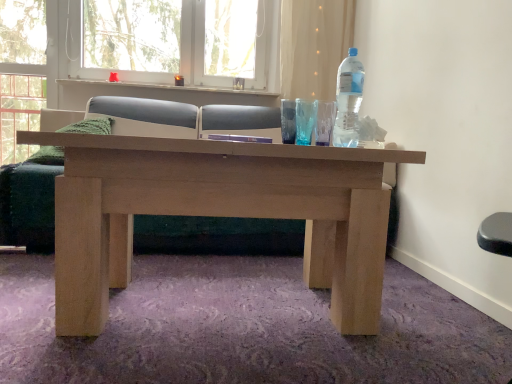
Measure the distance between transparent plastic bottle at upper right and camera.

The depth of transparent plastic bottle at upper right is 2.71 meters.

Find the location of a particular element. This screenshot has height=384, width=512. white plastic window frame at upper center is located at coordinates (195, 47).

The image size is (512, 384). In order to click on transparent plastic bottle at upper right in this screenshot , I will do `click(348, 100)`.

From the image's perspective, is transparent plastic bottle at upper right on white textured window sill at upper center?

No.

Which object is further away from the camera taking this photo, transparent plastic bottle at upper right or white textured window sill at upper center?

white textured window sill at upper center is further from the camera.

Is white textured window sill at upper center at the back of transparent plastic bottle at upper right?

That's not correct — transparent plastic bottle at upper right is not looking away from white textured window sill at upper center.

Are transparent plastic bottle at upper right and white textured window sill at upper center making contact?

No, transparent plastic bottle at upper right is not next to white textured window sill at upper center.

Does white plastic window frame at upper center have a greater height compared to transparent plastic bottle at upper right?

Yes.

Considering the sizes of objects white plastic window frame at upper center and transparent plastic bottle at upper right in the image provided, who is bigger, white plastic window frame at upper center or transparent plastic bottle at upper right?

white plastic window frame at upper center.

In the scene shown: Which is closer, (194, 36) or (341, 99)?

The point (341, 99) is more forward.

Does white plastic window frame at upper center lie in front of transparent plastic bottle at upper right?

No, it is behind transparent plastic bottle at upper right.

From a real-world perspective, is translucent fabric curtain at upper center located beneath transparent plastic bottle at upper right?

No, from a real-world perspective, translucent fabric curtain at upper center is not beneath transparent plastic bottle at upper right.

Is translucent fabric curtain at upper center taller or shorter than transparent plastic bottle at upper right?

In the image, translucent fabric curtain at upper center appears to be taller than transparent plastic bottle at upper right.

Choose the correct answer: Is translucent fabric curtain at upper center inside transparent plastic bottle at upper right or outside it?

translucent fabric curtain at upper center is spatially situated outside transparent plastic bottle at upper right.

From the image's perspective, is matte wood couch at center on top of translucent fabric curtain at upper center?

No, from the image's perspective, matte wood couch at center is not on top of translucent fabric curtain at upper center.

Considering the sizes of objects matte wood couch at center and translucent fabric curtain at upper center in the image provided, who is taller, matte wood couch at center or translucent fabric curtain at upper center?

With more height is translucent fabric curtain at upper center.

Is matte wood couch at center far away from translucent fabric curtain at upper center?

That's not correct — matte wood couch at center is a little close to translucent fabric curtain at upper center.

Which object is closer to the camera taking this photo, matte wood couch at center or white textured window sill at upper center?

matte wood couch at center is in front.

Between matte wood couch at center and white textured window sill at upper center, which one has larger size?

matte wood couch at center is bigger.

Can you confirm if white textured window sill at upper center is thinner than transparent plastic bottle at upper right?

No.

Is the position of white textured window sill at upper center less distant than that of transparent plastic bottle at upper right?

No.

In the scene shown: Does white textured window sill at upper center turn towards transparent plastic bottle at upper right?

No, white textured window sill at upper center is not facing towards transparent plastic bottle at upper right.

In terms of size, does white textured window sill at upper center appear bigger or smaller than transparent plastic bottle at upper right?

Clearly, white textured window sill at upper center is larger in size than transparent plastic bottle at upper right.

Between white plastic window frame at upper center and white textured window sill at upper center, which one has smaller width?

white plastic window frame at upper center is thinner.

Can you confirm if white plastic window frame at upper center is bigger than white textured window sill at upper center?

Yes.

Which object is further away from the camera, white plastic window frame at upper center or white textured window sill at upper center?

white plastic window frame at upper center is more distant.

Does white plastic window frame at upper center touch white textured window sill at upper center?

white plastic window frame at upper center is not next to white textured window sill at upper center, and they're not touching.

At what (x,y) coordinates should I click in order to perform the action: click on bottle lying on the right of white textured window sill at upper center. Please return your answer as a coordinate pair (x, y). Looking at the image, I should click on (348, 100).

The image size is (512, 384). Identify the location of window frame to the left of transparent plastic bottle at upper right. (195, 47).

From the image, which object appears to be farther from matte wood couch at center, translucent fabric curtain at upper center or white textured window sill at upper center?

translucent fabric curtain at upper center.

Estimate the real-world distances between objects in this image. Which object is closer to matte wood couch at center, white textured window sill at upper center or transparent plastic bottle at upper right?

white textured window sill at upper center lies closer to matte wood couch at center than the other object.

Looking at the image, which one is located further to transparent plastic bottle at upper right, translucent fabric curtain at upper center or white textured window sill at upper center?

white textured window sill at upper center is positioned further to the anchor transparent plastic bottle at upper right.

Looking at the image, which one is located further to white textured window sill at upper center, matte wood couch at center or translucent fabric curtain at upper center?

translucent fabric curtain at upper center lies further to white textured window sill at upper center than the other object.

From the image, which object appears to be nearer to white textured window sill at upper center, transparent plastic bottle at upper right or matte wood couch at center?

matte wood couch at center lies closer to white textured window sill at upper center than the other object.

From the picture: Looking at the image, which one is located further to white plastic window frame at upper center, translucent fabric curtain at upper center or transparent plastic bottle at upper right?

The object further to white plastic window frame at upper center is transparent plastic bottle at upper right.

Looking at the image, which one is located closer to transparent plastic bottle at upper right, matte wood couch at center or white textured window sill at upper center?

Among the two, matte wood couch at center is located nearer to transparent plastic bottle at upper right.

Looking at the image, which one is located further to matte wood couch at center, transparent plastic bottle at upper right or white textured window sill at upper center?

Based on the image, transparent plastic bottle at upper right appears to be further to matte wood couch at center.

The width and height of the screenshot is (512, 384). I want to click on window sill located between matte wood couch at center and translucent fabric curtain at upper center in the depth direction, so [156, 89].

Identify the location of studio couch between transparent plastic bottle at upper right and white textured window sill at upper center along the z-axis. The width and height of the screenshot is (512, 384). (182, 118).

This screenshot has width=512, height=384. I want to click on window frame situated between white textured window sill at upper center and translucent fabric curtain at upper center from left to right, so click(x=195, y=47).

Where is `window sill between transparent plastic bottle at upper right and translucent fabric curtain at upper center along the z-axis`? This screenshot has width=512, height=384. window sill between transparent plastic bottle at upper right and translucent fabric curtain at upper center along the z-axis is located at coordinates (156, 89).